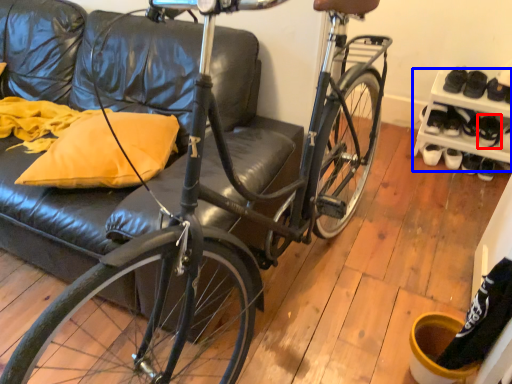
Question: Which of the following is the farthest to the observer, shoe (highlighted by a red box) or shelf (highlighted by a blue box)?

Choices:
 (A) shoe
 (B) shelf

Answer: (A)